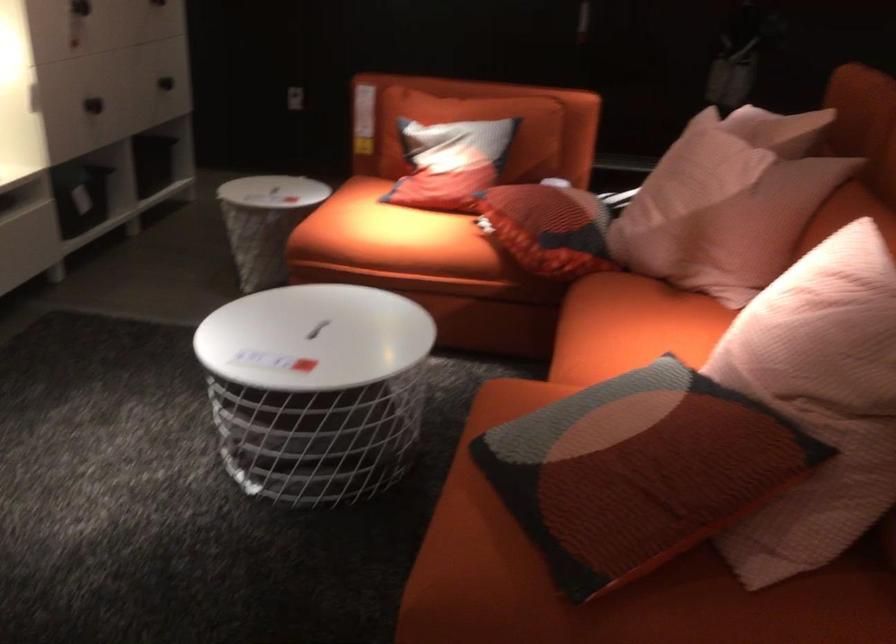
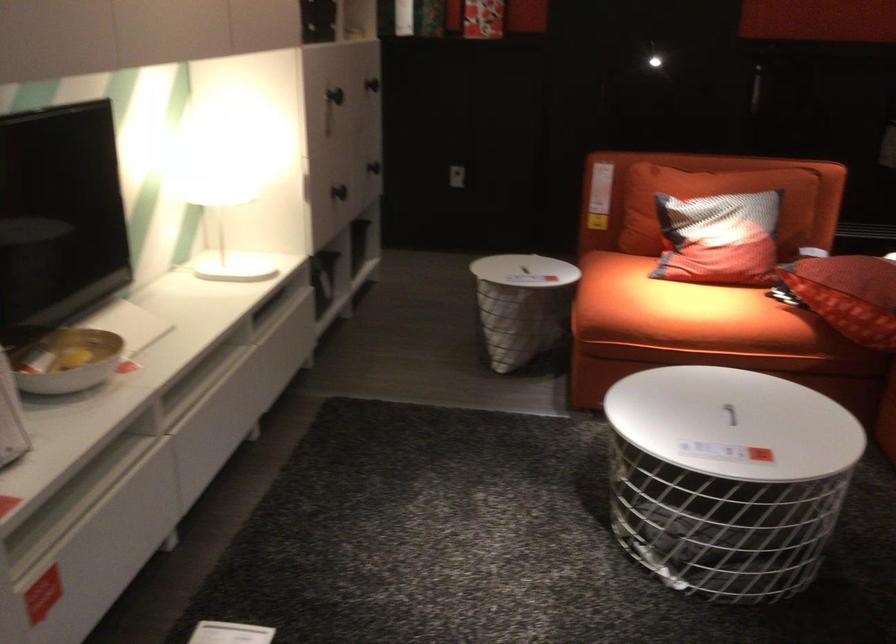
The point at (95, 100) is marked in the first image. Where is the corresponding point in the second image?

(339, 192)